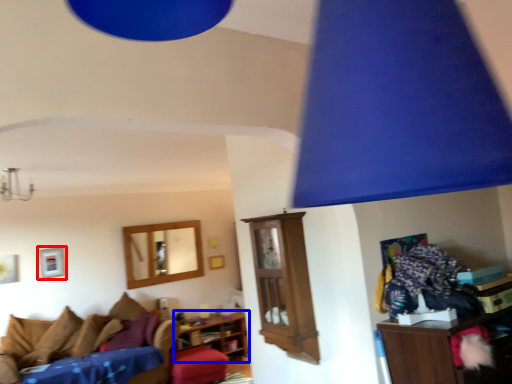
Question: Which object is closer to the camera taking this photo, picture frame (highlighted by a red box) or shelf (highlighted by a blue box)?

Choices:
 (A) picture frame
 (B) shelf

Answer: (A)